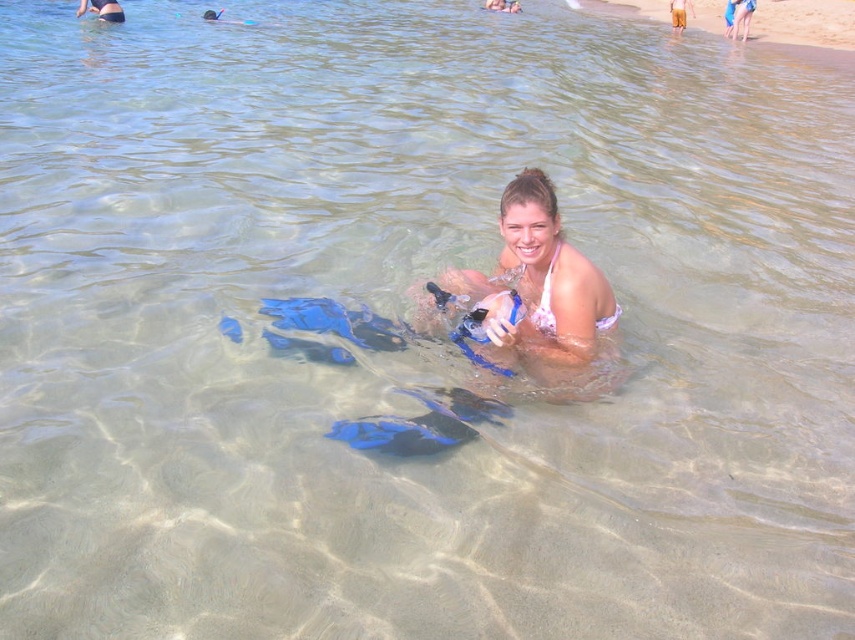
Question: Is white bikini at center further to the viewer compared to pink fabric bikini at upper center?

Choices:
 (A) yes
 (B) no

Answer: (B)

Question: Can you confirm if white bikini at center is positioned to the left of pink fabric bikini at upper center?

Choices:
 (A) no
 (B) yes

Answer: (A)

Question: Is white bikini at center above pink fabric bikini at upper center?

Choices:
 (A) no
 (B) yes

Answer: (A)

Question: Among these objects, which one is farthest from the camera?

Choices:
 (A) pink fabric bikini at upper center
 (B) white bikini at center

Answer: (A)